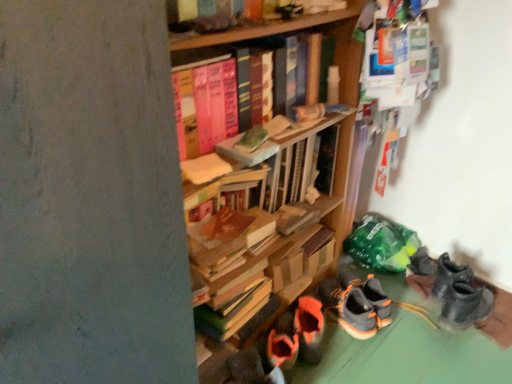
Question: Would you say hardcover books at upper center is inside or outside gray suede sneakers at lower center?

Choices:
 (A) inside
 (B) outside

Answer: (B)

Question: From the image's perspective, is hardcover books at upper center located above or below gray suede sneakers at lower center?

Choices:
 (A) above
 (B) below

Answer: (A)

Question: Is hardcover books at upper center in front of or behind gray suede sneakers at lower center in the image?

Choices:
 (A) front
 (B) behind

Answer: (A)

Question: Looking at their shapes, would you say gray suede sneakers at lower center is wider or thinner than hardcover books at upper center?

Choices:
 (A) thin
 (B) wide

Answer: (B)

Question: Do you think gray suede sneakers at lower center is within hardcover books at upper center, or outside of it?

Choices:
 (A) outside
 (B) inside

Answer: (A)

Question: In the image, is gray suede sneakers at lower center positioned in front of or behind hardcover books at upper center?

Choices:
 (A) front
 (B) behind

Answer: (B)

Question: Is point pos(381,321) closer or farther from the camera than point pos(192,82)?

Choices:
 (A) closer
 (B) farther

Answer: (B)